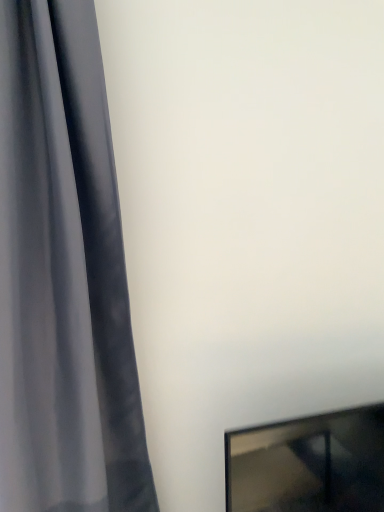
The width and height of the screenshot is (384, 512). Describe the element at coordinates (63, 276) in the screenshot. I see `satin gray curtain at left` at that location.

I want to click on satin gray curtain at left, so click(x=63, y=276).

What are the coordinates of `satin gray curtain at left` in the screenshot? It's located at (63, 276).